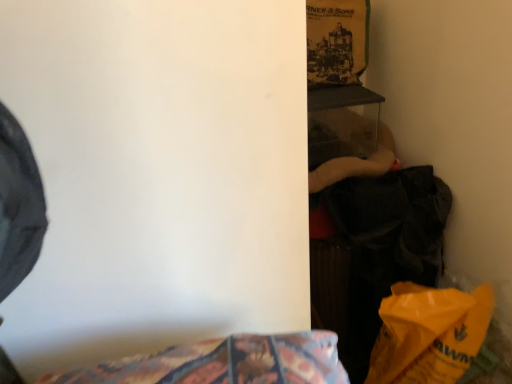
Question: Is yellow matte paper bag at lower right outside of dark gray fabric at right?

Choices:
 (A) yes
 (B) no

Answer: (A)

Question: From a real-world perspective, is yellow matte paper bag at lower right positioned under dark gray fabric at right based on gravity?

Choices:
 (A) yes
 (B) no

Answer: (A)

Question: Considering the relative positions of yellow matte paper bag at lower right and dark gray fabric at right in the image provided, is yellow matte paper bag at lower right to the left of dark gray fabric at right from the viewer's perspective?

Choices:
 (A) yes
 (B) no

Answer: (B)

Question: Is yellow matte paper bag at lower right facing towards dark gray fabric at right?

Choices:
 (A) no
 (B) yes

Answer: (A)

Question: From a real-world perspective, is yellow matte paper bag at lower right located higher than dark gray fabric at right?

Choices:
 (A) yes
 (B) no

Answer: (B)

Question: Is yellow matte paper bag at lower right oriented away from dark gray fabric at right?

Choices:
 (A) yes
 (B) no

Answer: (A)

Question: Is dark gray fabric at right not close to yellow matte paper bag at lower right?

Choices:
 (A) yes
 (B) no

Answer: (B)

Question: Can you confirm if dark gray fabric at right is positioned to the left of yellow matte paper bag at lower right?

Choices:
 (A) no
 (B) yes

Answer: (B)

Question: Is dark gray fabric at right smaller than yellow matte paper bag at lower right?

Choices:
 (A) no
 (B) yes

Answer: (A)

Question: Is dark gray fabric at right not within yellow matte paper bag at lower right?

Choices:
 (A) no
 (B) yes

Answer: (B)

Question: From the image's perspective, would you say dark gray fabric at right is positioned over yellow matte paper bag at lower right?

Choices:
 (A) yes
 (B) no

Answer: (A)

Question: Is dark gray fabric at right shorter than yellow matte paper bag at lower right?

Choices:
 (A) yes
 (B) no

Answer: (B)

Question: From a real-world perspective, is dark gray fabric at right positioned above or below yellow matte paper bag at lower right?

Choices:
 (A) above
 (B) below

Answer: (A)